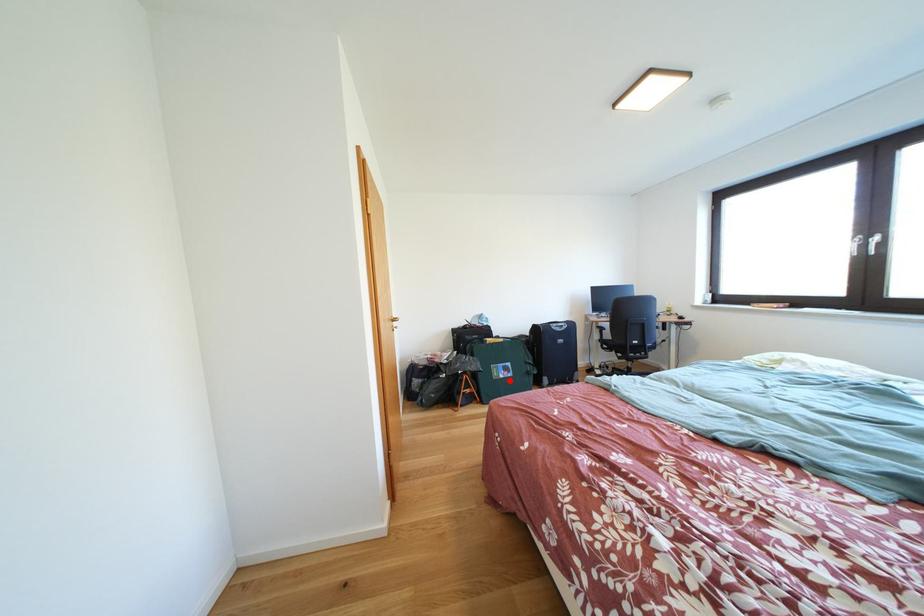
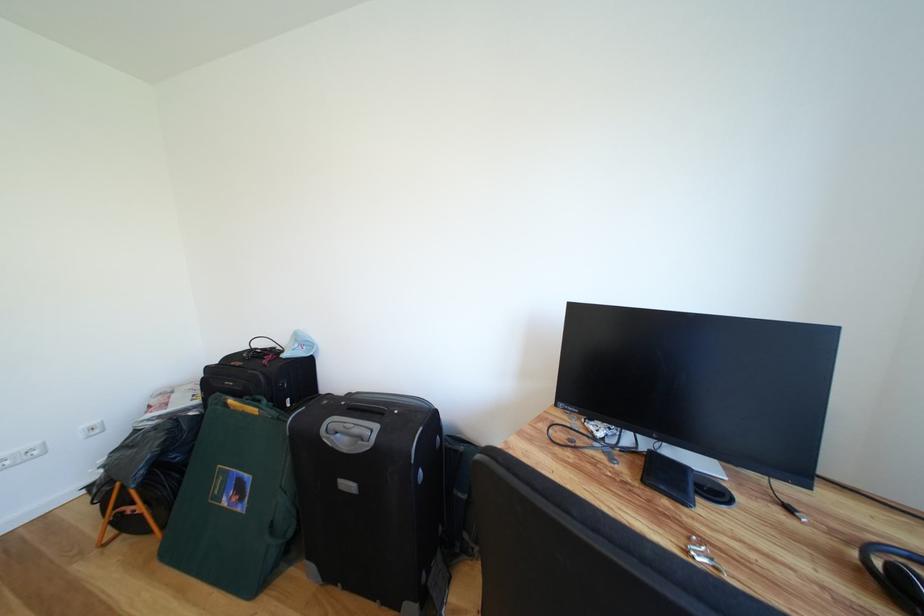
In the second image, find the point that corresponds to the highlighted location in the first image.

(234, 506)